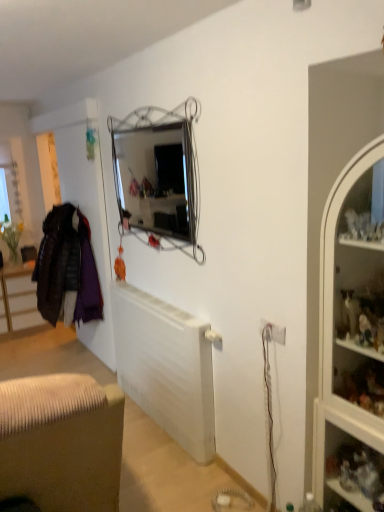
This screenshot has height=512, width=384. Find the location of `blank space above white matte radiator at center (from a real-world perspective)`. blank space above white matte radiator at center (from a real-world perspective) is located at coordinates (171, 305).